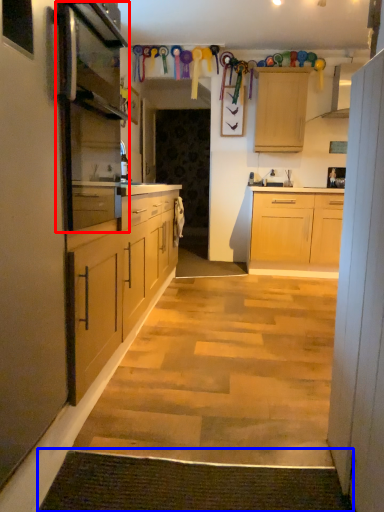
Question: Which object is further to the camera taking this photo, appliance (highlighted by a red box) or doormat (highlighted by a blue box)?

Choices:
 (A) appliance
 (B) doormat

Answer: (A)